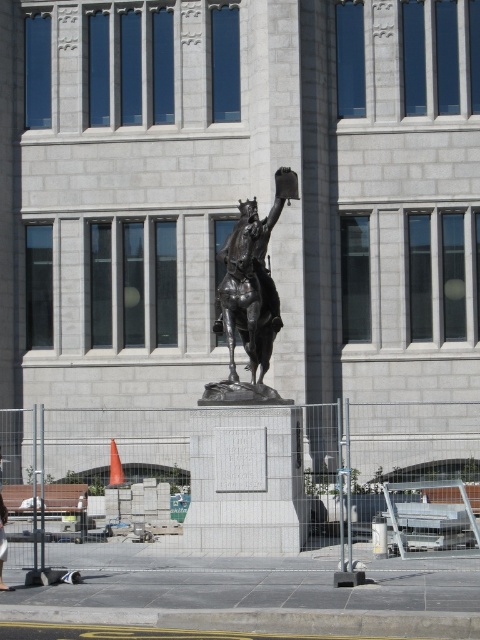
Who is taller, concrete fence at center or bronze statue at center?

concrete fence at center

Is concrete fence at center below bronze statue at center?

Yes, concrete fence at center is below bronze statue at center.

Does point (344, 632) lie in front of point (271, 308)?

Yes, point (344, 632) is in front of point (271, 308).

Image resolution: width=480 pixels, height=640 pixels. In order to click on concrete fence at center in this screenshot , I will do `click(249, 518)`.

Can you confirm if concrete fence at center is positioned below light brown wooden bench at center?

No.

Find the location of a particular element. The image size is (480, 640). concrete fence at center is located at coordinates (249, 518).

You are a GUI agent. You are given a task and a screenshot of the screen. Output one action in this format:
    pyautogui.click(x=<x>, y=<y>)
    Task: Click on the concrete fence at center
    
    Given the screenshot: What is the action you would take?
    pyautogui.click(x=249, y=518)

Is bronze statue at center smaller than light brown wooden bench at center?

Indeed, bronze statue at center has a smaller size compared to light brown wooden bench at center.

Which is below, bronze statue at center or light brown wooden bench at center?

light brown wooden bench at center is below.

Locate an element on the screen. This screenshot has width=480, height=640. bronze statue at center is located at coordinates point(250,300).

Image resolution: width=480 pixels, height=640 pixels. Find the location of `bronze statue at center`. bronze statue at center is located at coordinates (250, 300).